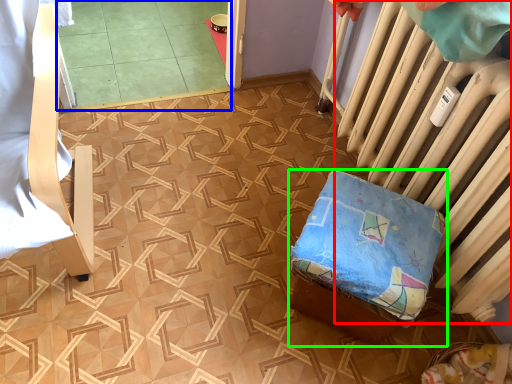
Question: Which object is positioned closest to radiator (highlighted by a red box)? Select from tile (highlighted by a blue box) and furniture (highlighted by a green box).

Choices:
 (A) tile
 (B) furniture

Answer: (B)